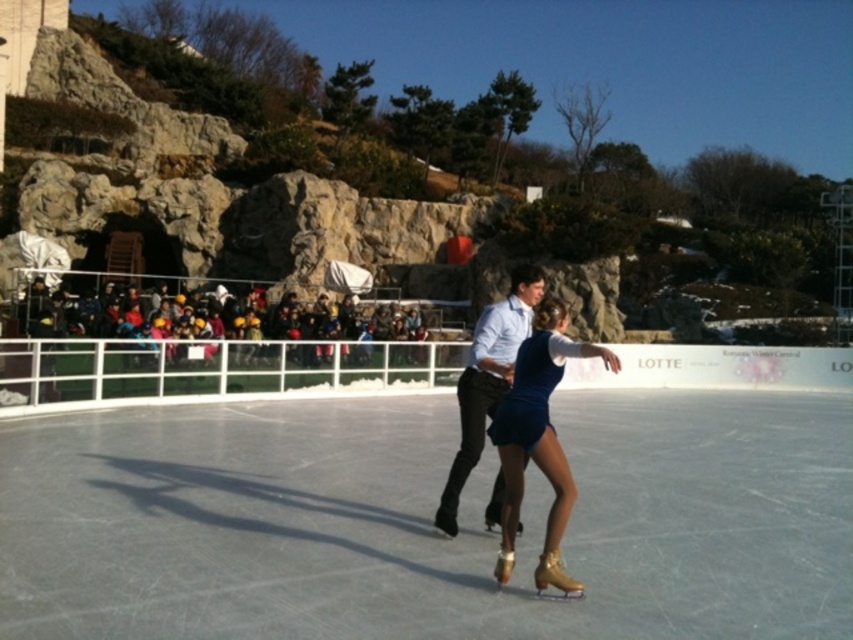
This screenshot has width=853, height=640. What do you see at coordinates (426, 520) in the screenshot?
I see `white ice skating rink at center` at bounding box center [426, 520].

Is point (751, 552) more distant than point (529, 372)?

That is True.

Is point (445, 413) in front of point (570, 483)?

No, it is behind (570, 483).

Locate an element on the screen. This screenshot has width=853, height=640. white ice skating rink at center is located at coordinates (426, 520).

Is gold metallic ice skate at lower center above gold metallic ice skate at center?

Actually, gold metallic ice skate at lower center is below gold metallic ice skate at center.

Between gold metallic ice skate at lower center and gold metallic ice skate at center, which one has less height?

gold metallic ice skate at center is shorter.

Does point (561, 568) lie behind point (496, 561)?

No, (561, 568) is in front of (496, 561).

The width and height of the screenshot is (853, 640). In order to click on gold metallic ice skate at lower center in this screenshot , I will do 555,579.

Between point (654, 428) and point (459, 448), which one is positioned in front?

Point (459, 448) is in front.

Who is lower down, white ice skating rink at center or matte blue shirt at center?

white ice skating rink at center

This screenshot has height=640, width=853. I want to click on white ice skating rink at center, so [426, 520].